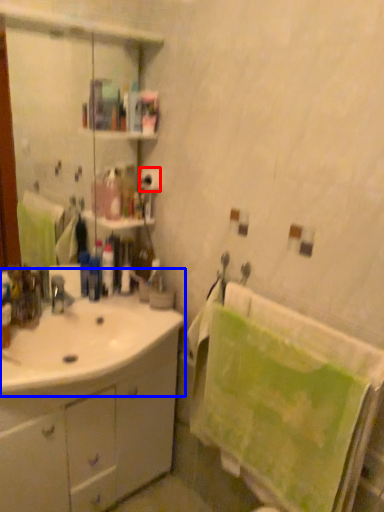
Question: Which object is further to the camera taking this photo, toilet paper (highlighted by a red box) or sink (highlighted by a blue box)?

Choices:
 (A) toilet paper
 (B) sink

Answer: (A)